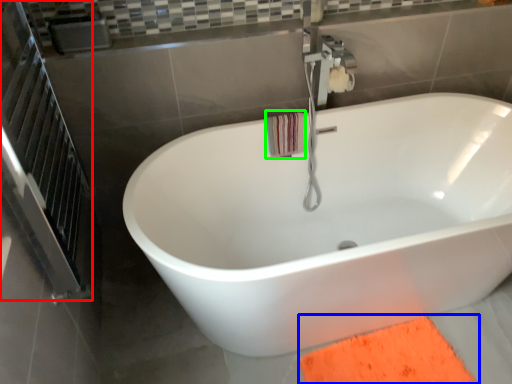
Question: Based on their relative distances, which object is farther from screen door (highlighted by a red box)? Choose from doormat (highlighted by a blue box) and beach towel (highlighted by a green box).

Choices:
 (A) doormat
 (B) beach towel

Answer: (A)